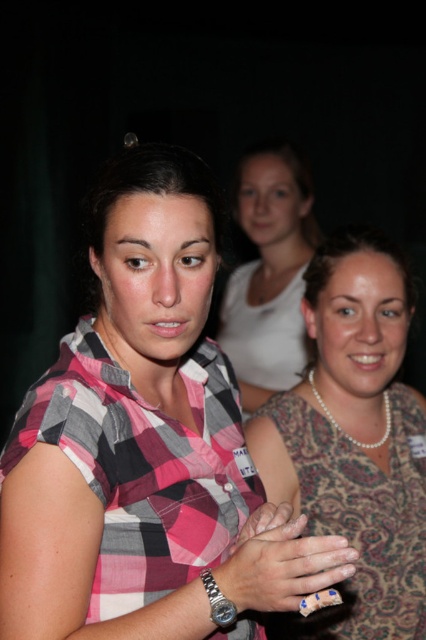
Is point (275, 198) in front of point (313, 570)?

No, (275, 198) is further to viewer.

Where is `white matte tank top at center`? white matte tank top at center is located at coordinates (268, 275).

Identify the location of white matte tank top at center. This screenshot has height=640, width=426. (268, 275).

Who is higher up, patterned fabric dress at center or smooth skin hand at center?

patterned fabric dress at center is above.

Identify the location of patterned fabric dress at center. The width and height of the screenshot is (426, 640). (354, 436).

This screenshot has height=640, width=426. Find the location of `patterned fabric dress at center`. patterned fabric dress at center is located at coordinates (354, 436).

The width and height of the screenshot is (426, 640). What do you see at coordinates (354, 436) in the screenshot?
I see `patterned fabric dress at center` at bounding box center [354, 436].

Describe the element at coordinates (354, 436) in the screenshot. Image resolution: width=426 pixels, height=640 pixels. I see `patterned fabric dress at center` at that location.

This screenshot has width=426, height=640. I want to click on patterned fabric dress at center, so click(354, 436).